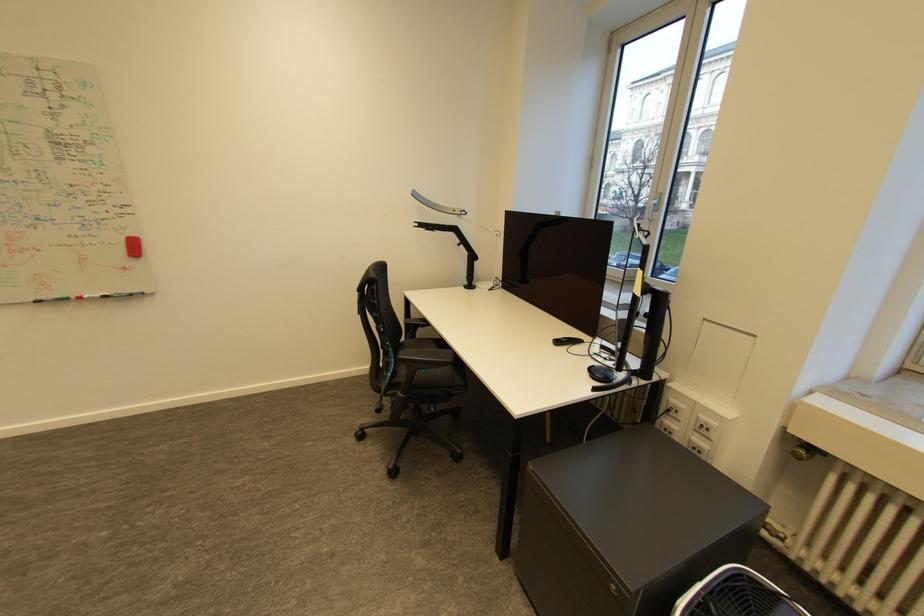
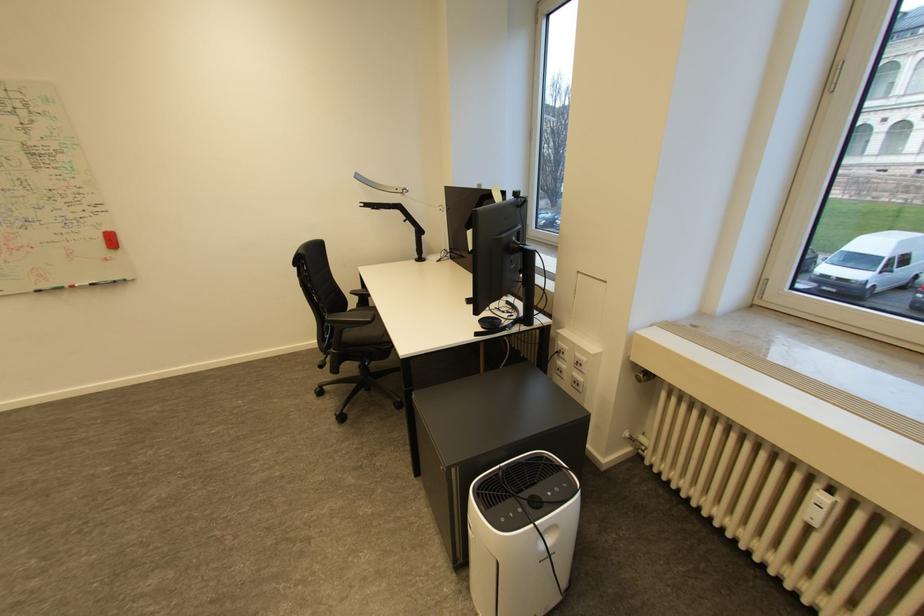
Locate, in the second image, the point that corresponds to point 457,236 in the first image.

(405, 213)